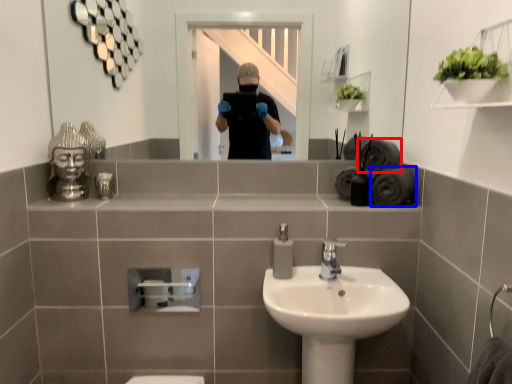
Question: Which of the following is the farthest to the observer, bath towel (highlighted by a red box) or bath towel (highlighted by a blue box)?

Choices:
 (A) bath towel
 (B) bath towel

Answer: (A)